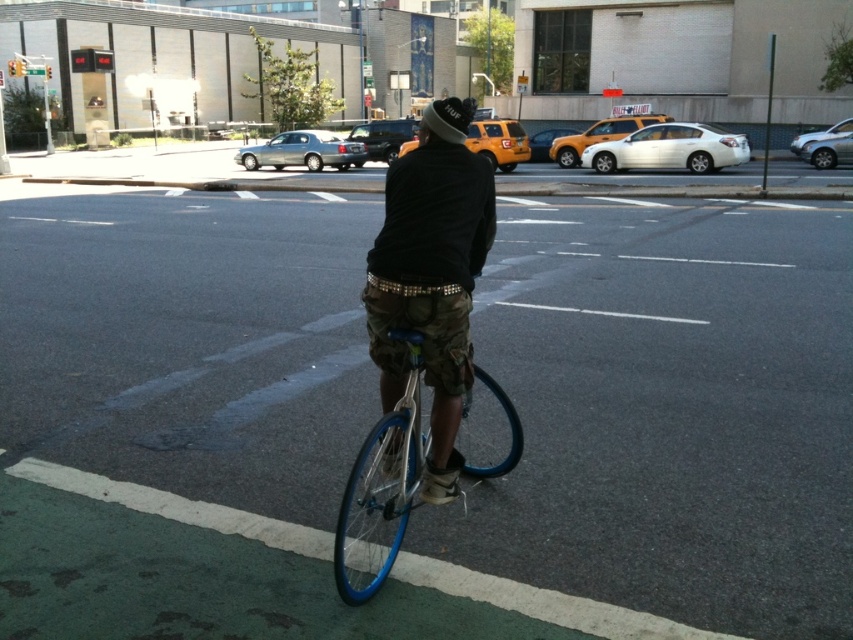
From the picture: Between green asphalt bike lane at center and camouflage shorts at center, which one has more height?

Standing taller between the two is green asphalt bike lane at center.

Where is `green asphalt bike lane at center`? green asphalt bike lane at center is located at coordinates (670, 412).

Is green asphalt bike lane at center further to the viewer compared to blue metallic bicycle at center?

Yes, it is.

Looking at this image, does green asphalt bike lane at center appear under blue metallic bicycle at center?

Actually, green asphalt bike lane at center is above blue metallic bicycle at center.

Who is more forward, (537, 432) or (364, 566)?

Point (364, 566)

Locate an element on the screen. green asphalt bike lane at center is located at coordinates (670, 412).

Who is positioned more to the left, camouflage shorts at center or blue metallic bicycle at center?

camouflage shorts at center is more to the left.

Is point (412, 257) closer to viewer compared to point (369, 458)?

Yes, it is in front of point (369, 458).

Who is more distant from viewer, [491,234] or [357,518]?

The point [357,518] is behind.

Find the location of `camouflage shorts at center`. camouflage shorts at center is located at coordinates (431, 275).